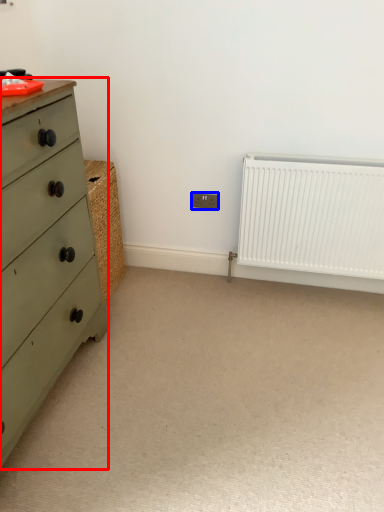
Question: Which object is closer to the camera taking this photo, chest of drawers (highlighted by a red box) or electric outlet (highlighted by a blue box)?

Choices:
 (A) chest of drawers
 (B) electric outlet

Answer: (A)